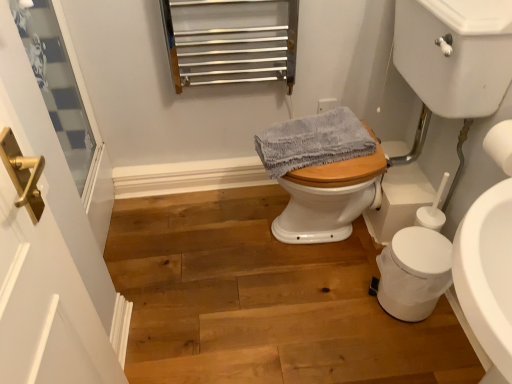
Question: From a real-world perspective, is white matte toilet paper at right below gray textured towel at center?

Choices:
 (A) yes
 (B) no

Answer: (B)

Question: Considering the relative sizes of white matte toilet paper at right and gray textured towel at center in the image provided, is white matte toilet paper at right bigger than gray textured towel at center?

Choices:
 (A) no
 (B) yes

Answer: (A)

Question: Considering the relative positions of white matte toilet paper at right and gray textured towel at center in the image provided, is white matte toilet paper at right in front of gray textured towel at center?

Choices:
 (A) no
 (B) yes

Answer: (B)

Question: Can you confirm if white matte toilet paper at right is shorter than gray textured towel at center?

Choices:
 (A) yes
 (B) no

Answer: (B)

Question: Is white matte toilet paper at right not inside gray textured towel at center?

Choices:
 (A) yes
 (B) no

Answer: (A)

Question: Is white glass screen door at left taller or shorter than gray textured towel at center?

Choices:
 (A) short
 (B) tall

Answer: (B)

Question: Do you think white glass screen door at left is within gray textured towel at center, or outside of it?

Choices:
 (A) outside
 (B) inside

Answer: (A)

Question: Looking at their shapes, would you say white glass screen door at left is wider or thinner than gray textured towel at center?

Choices:
 (A) wide
 (B) thin

Answer: (B)

Question: Based on their positions, is white glass screen door at left located to the left or right of gray textured towel at center?

Choices:
 (A) left
 (B) right

Answer: (A)

Question: From the image's perspective, is wooden floor at center positioned above or below white matte trash can at lower right?

Choices:
 (A) above
 (B) below

Answer: (B)

Question: Is point (340, 377) positioned closer to the camera than point (379, 264)?

Choices:
 (A) farther
 (B) closer

Answer: (B)

Question: In terms of height, does wooden floor at center look taller or shorter compared to white matte trash can at lower right?

Choices:
 (A) tall
 (B) short

Answer: (B)

Question: In terms of size, does wooden floor at center appear bigger or smaller than white matte trash can at lower right?

Choices:
 (A) big
 (B) small

Answer: (A)

Question: In terms of height, does white glass screen door at left look taller or shorter compared to wooden floor at center?

Choices:
 (A) short
 (B) tall

Answer: (B)

Question: Considering their positions, is white glass screen door at left located in front of or behind wooden floor at center?

Choices:
 (A) front
 (B) behind

Answer: (A)